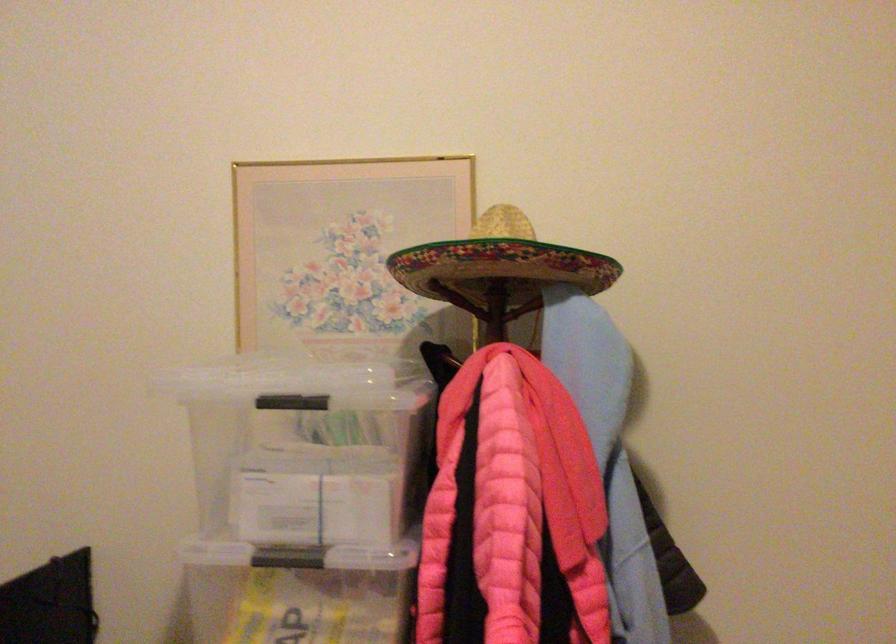
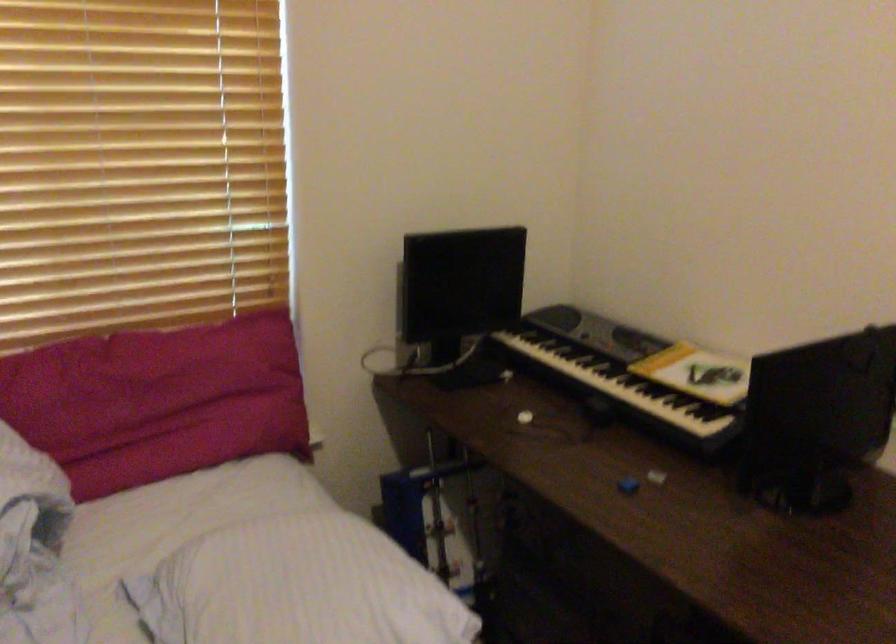
The first image is from the beginning of the video and the second image is from the end. How did the camera likely rotate when shooting the video?

The camera's rotation is toward left-down.